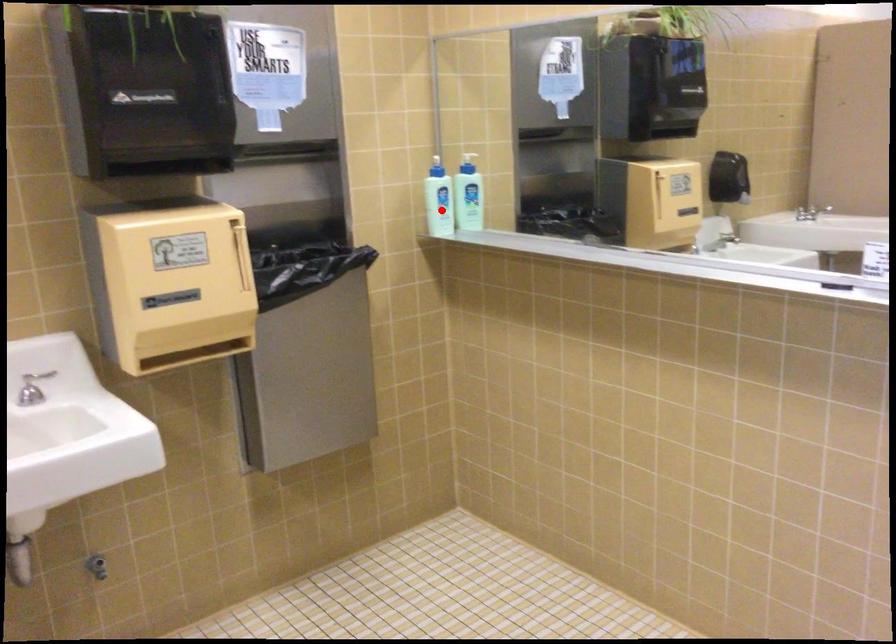
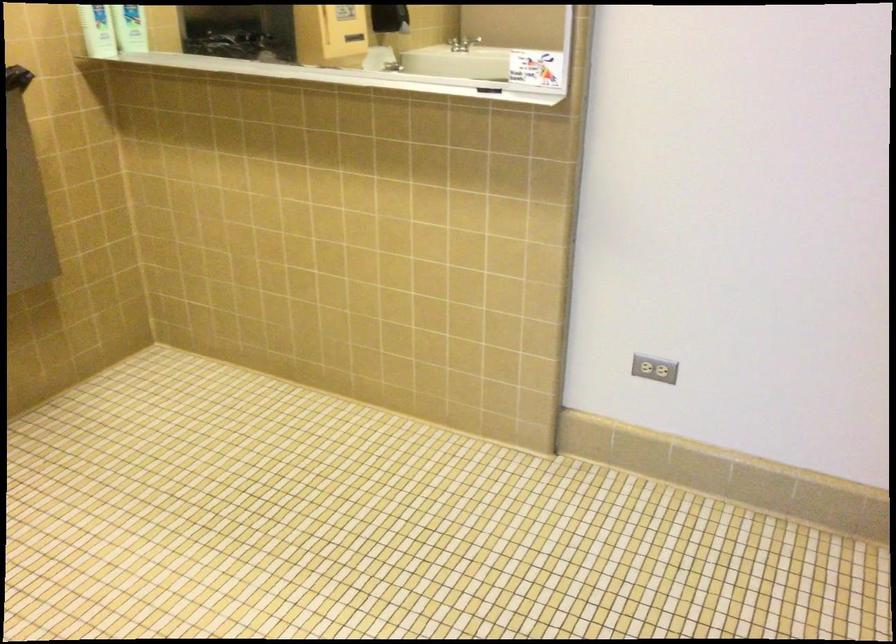
Locate, in the second image, the point that corresponds to the highlighted location in the first image.

(97, 31)